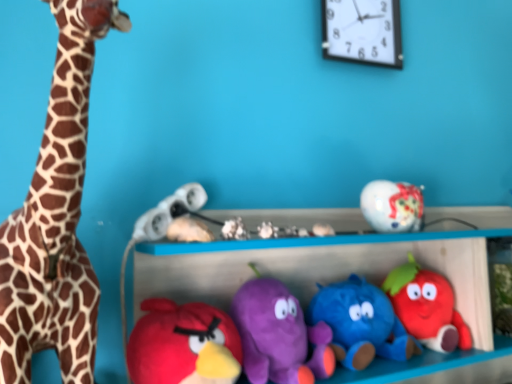
Question: Does matte white toy at center, which ranks as the 8th toy in right-to-left order, have a smaller size compared to soft plush strawberry at center right, the 1th toy viewed from the right?

Choices:
 (A) yes
 (B) no

Answer: (A)

Question: Does matte white toy at center, which ranks as the second toy in left-to-right order, have a greater width compared to soft plush strawberry at center right, which ranks as the ninth toy in left-to-right order?

Choices:
 (A) no
 (B) yes

Answer: (A)

Question: From the image's perspective, is matte white toy at center, which ranks as the 8th toy in right-to-left order, below soft plush strawberry at center right, which ranks as the ninth toy in left-to-right order?

Choices:
 (A) no
 (B) yes

Answer: (A)

Question: Is matte white toy at center, which ranks as the 8th toy in right-to-left order, thinner than soft plush strawberry at center right, the 1th toy viewed from the right?

Choices:
 (A) yes
 (B) no

Answer: (A)

Question: From a real-world perspective, is matte white toy at center, which ranks as the second toy in left-to-right order, under soft plush strawberry at center right, the 1th toy viewed from the right?

Choices:
 (A) no
 (B) yes

Answer: (A)

Question: From the image's perspective, is white matte seashell at center, which appears as the fifth toy when viewed from the right, above or below white plastic clock at upper center?

Choices:
 (A) below
 (B) above

Answer: (A)

Question: Is white matte seashell at center, which appears as the fifth toy when viewed from the right, taller or shorter than white plastic clock at upper center?

Choices:
 (A) short
 (B) tall

Answer: (A)

Question: In terms of size, does white matte seashell at center, which appears as the fifth toy when viewed from the right, appear bigger or smaller than white plastic clock at upper center?

Choices:
 (A) big
 (B) small

Answer: (B)

Question: Considering the positions of white matte seashell at center, which appears as the fifth toy when viewed from the right, and white plastic clock at upper center in the image, is white matte seashell at center, which appears as the fifth toy when viewed from the right, wider or thinner than white plastic clock at upper center?

Choices:
 (A) thin
 (B) wide

Answer: (B)

Question: Considering their positions, is white matte headphones at center, which ranks as the first toy in left-to-right order, located in front of or behind white plastic clock at upper center?

Choices:
 (A) front
 (B) behind

Answer: (A)

Question: Is white matte headphones at center, which ranks as the first toy in left-to-right order, to the left or to the right of white plastic clock at upper center in the image?

Choices:
 (A) right
 (B) left

Answer: (B)

Question: Is white matte headphones at center, which ranks as the first toy in left-to-right order, wider or thinner than white plastic clock at upper center?

Choices:
 (A) thin
 (B) wide

Answer: (B)

Question: From their relative heights in the image, would you say white matte headphones at center, placed as the ninth toy when sorted from right to left, is taller or shorter than white plastic clock at upper center?

Choices:
 (A) tall
 (B) short

Answer: (B)

Question: Relative to white plastic clock at upper center, is spotted fur giraffe at left in front or behind?

Choices:
 (A) behind
 (B) front

Answer: (B)

Question: From a real-world perspective, is spotted fur giraffe at left physically located above or below white plastic clock at upper center?

Choices:
 (A) above
 (B) below

Answer: (B)